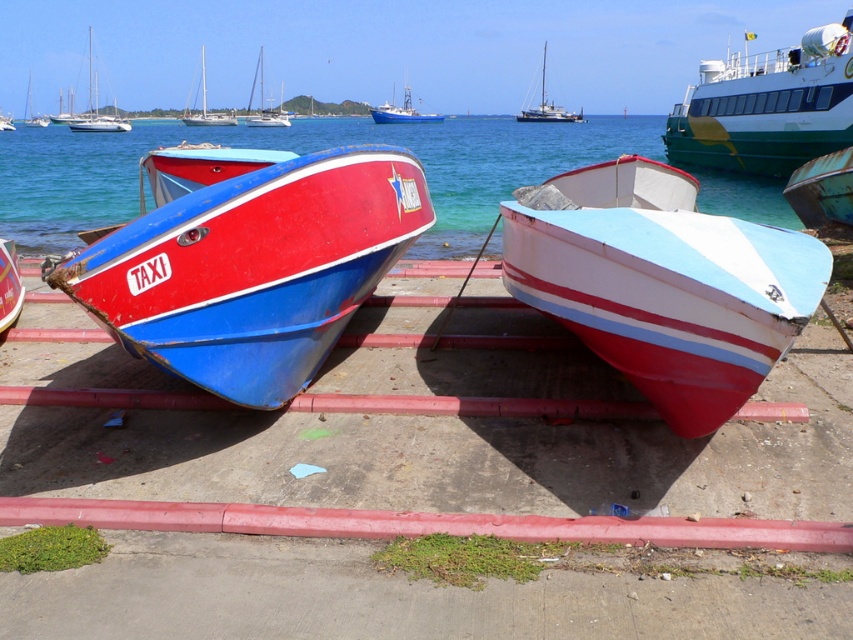
You are a tourist standing on the pier and want to take a boat ride. You see the rusty metal boat at right and the red matte taxi boat at left. Which boat is farther away from you?

The rusty metal boat at right is farther away from you because it is 96.19 meters away from the red matte taxi boat at left, which is closer to you.

You are a photographer wanting to capture both the white glossy sailboat at upper center and the red matte taxi boat at left in a single shot. Based on their heights, which boat will appear taller in the photo?

The white glossy sailboat at upper center will appear taller in the photo because it has a greater height compared to the red matte taxi boat at left.